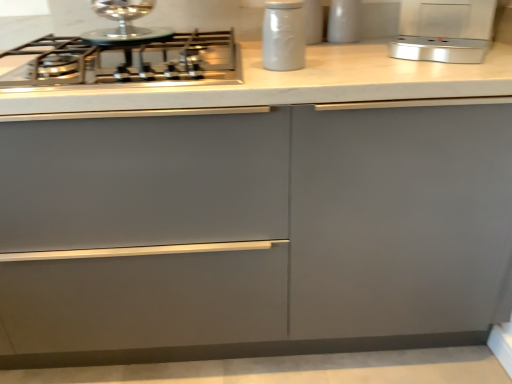
Question: From their relative heights in the image, would you say white glossy jar at upper center, the 2th kitchen appliance from the right, is taller or shorter than satin steel gas stove at upper left?

Choices:
 (A) tall
 (B) short

Answer: (A)

Question: Is white glossy jar at upper center, the 2th kitchen appliance positioned from the left, in front of or behind satin steel gas stove at upper left in the image?

Choices:
 (A) front
 (B) behind

Answer: (B)

Question: Estimate the real-world distances between objects in this image. Which object is farther from the white matte jar at upper center, which is counted as the third kitchen appliance, starting from the right?

Choices:
 (A) white matte jar at upper center
 (B) matte gray cabinet at center
 (C) satin silver toaster at upper right, the 3th kitchen appliance in the left-to-right sequence
 (D) satin steel gas stove at upper left
 (E) white glossy jar at upper center, the 2th kitchen appliance from the right

Answer: (B)

Question: Estimate the real-world distances between objects in this image. Which object is closer to the white matte jar at upper center?

Choices:
 (A) white glossy jar at upper center, the 2th kitchen appliance from the right
 (B) white matte jar at upper center, which is counted as the third kitchen appliance, starting from the right
 (C) satin silver toaster at upper right, placed as the 1th kitchen appliance when sorted from right to left
 (D) satin steel gas stove at upper left
 (E) matte gray cabinet at center

Answer: (A)